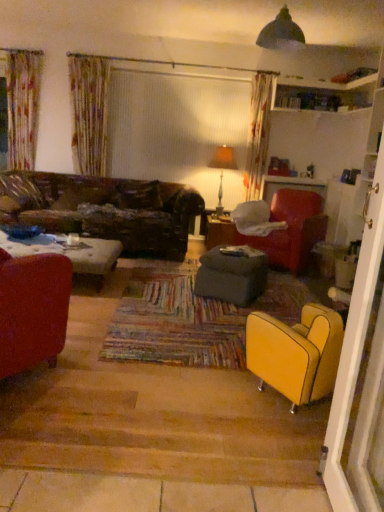
Question: Is matte orange lampshade at upper center positioned behind matte red armchair at left, placed as the third chair when sorted from right to left?

Choices:
 (A) yes
 (B) no

Answer: (A)

Question: Is matte orange lampshade at upper center far away from matte red armchair at left, the first chair when ordered from left to right?

Choices:
 (A) no
 (B) yes

Answer: (B)

Question: Is matte orange lampshade at upper center taller than matte red armchair at left, positioned as the first chair in front-to-back order?

Choices:
 (A) yes
 (B) no

Answer: (A)

Question: From the image's perspective, does matte orange lampshade at upper center appear lower than matte red armchair at left, the first chair when ordered from left to right?

Choices:
 (A) yes
 (B) no

Answer: (B)

Question: Is matte orange lampshade at upper center directly adjacent to matte red armchair at left, positioned as the first chair in front-to-back order?

Choices:
 (A) yes
 (B) no

Answer: (B)

Question: Would you say matte red armchair at left, placed as the third chair when sorted from right to left, is part of matte orange lampshade at upper center's contents?

Choices:
 (A) yes
 (B) no

Answer: (B)

Question: Is yellow leather armchair at lower right, which is the 2th chair in left-to-right order, positioned far away from velvet red armchair at center-right, which is the first chair from right to left?

Choices:
 (A) yes
 (B) no

Answer: (A)

Question: From the image's perspective, does yellow leather armchair at lower right, the 2th chair from the right, appear higher than velvet red armchair at center-right, which is the first chair from right to left?

Choices:
 (A) no
 (B) yes

Answer: (A)

Question: Considering the relative sizes of yellow leather armchair at lower right, which is the second chair in back-to-front order, and velvet red armchair at center-right, which appears as the 1th chair when viewed from the back, in the image provided, is yellow leather armchair at lower right, which is the second chair in back-to-front order, smaller than velvet red armchair at center-right, which appears as the 1th chair when viewed from the back,?

Choices:
 (A) no
 (B) yes

Answer: (B)

Question: Is yellow leather armchair at lower right, which is the 2th chair in left-to-right order, aimed at velvet red armchair at center-right, which is the third chair from front to back?

Choices:
 (A) yes
 (B) no

Answer: (B)

Question: From the image's perspective, is yellow leather armchair at lower right, which is the 2th chair in left-to-right order, located beneath velvet red armchair at center-right, the third chair in the left-to-right sequence?

Choices:
 (A) no
 (B) yes

Answer: (B)

Question: Can you confirm if yellow leather armchair at lower right, which is the 2th chair in left-to-right order, is positioned to the right of velvet red armchair at center-right, the third chair in the left-to-right sequence?

Choices:
 (A) yes
 (B) no

Answer: (B)

Question: Does velvet red armchair at center-right, which appears as the 1th chair when viewed from the back, come behind matte red armchair at left, positioned as the first chair in front-to-back order?

Choices:
 (A) yes
 (B) no

Answer: (A)